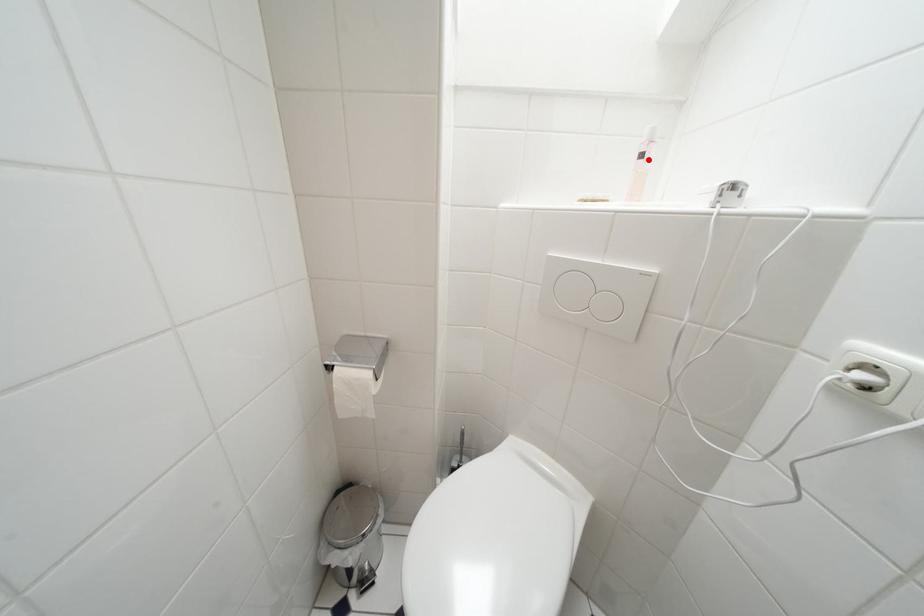
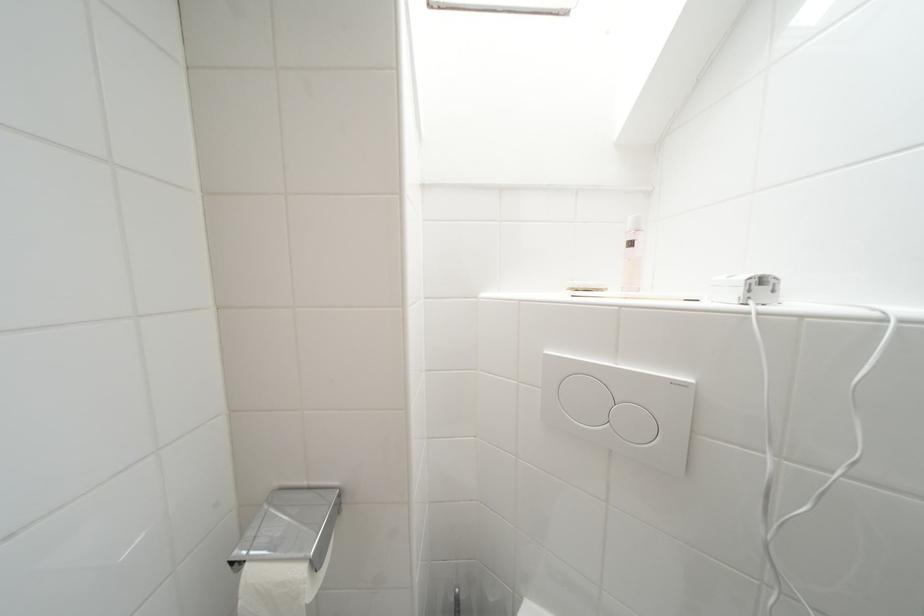
Where in the second image is the point corresponding to the highlighted location from the first image?

(638, 246)